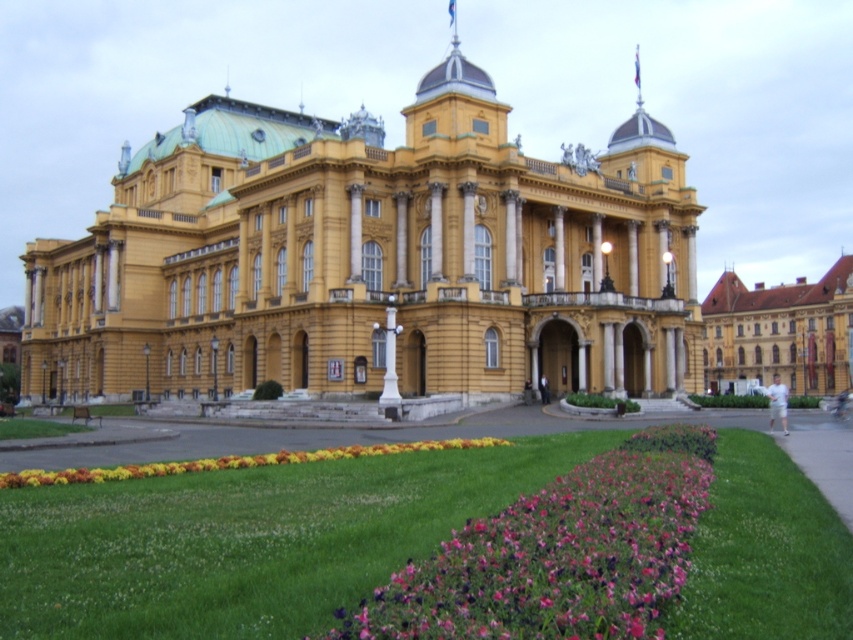
Question: Among these objects, which one is farthest from the camera?

Choices:
 (A) brown textured building at right
 (B) green grass at lower center

Answer: (A)

Question: Which object is the farthest from the brown textured building at right?

Choices:
 (A) multicolored fabric flower bed at lower center
 (B) yellow stone building at center
 (C) purple matte flowers at lower center

Answer: (A)

Question: Among these points, which one is nearest to the camera?

Choices:
 (A) (440, 465)
 (B) (637, 532)
 (C) (430, 445)

Answer: (B)

Question: Where is green grass at lower center located in relation to purple matte flowers at lower center in the image?

Choices:
 (A) below
 (B) above

Answer: (A)

Question: Is green grass at lower center thinner than brown textured building at right?

Choices:
 (A) no
 (B) yes

Answer: (B)

Question: Does brown textured building at right appear on the right side of multicolored fabric flower bed at lower center?

Choices:
 (A) no
 (B) yes

Answer: (B)